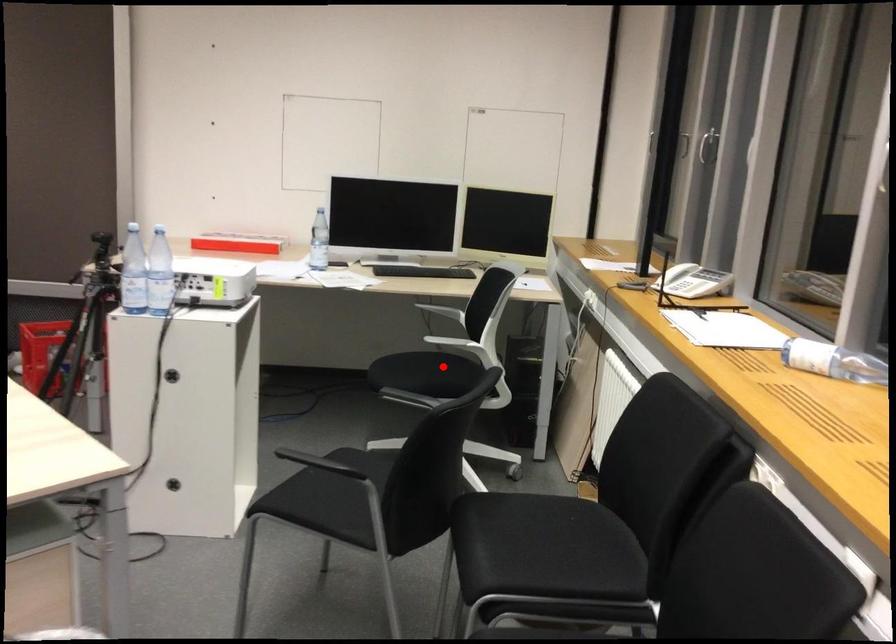
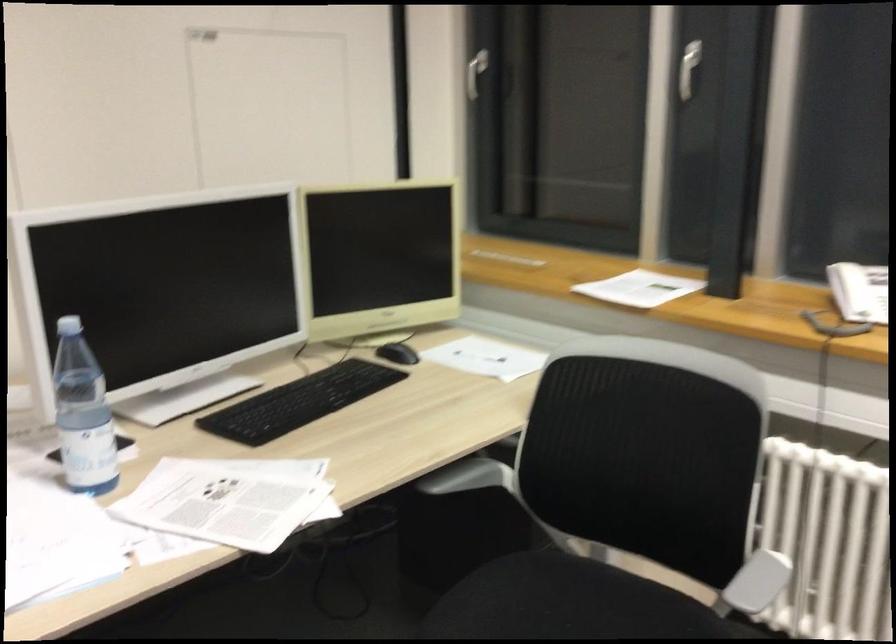
Locate, in the second image, the point that corresponds to the highlighted location in the first image.

(570, 603)